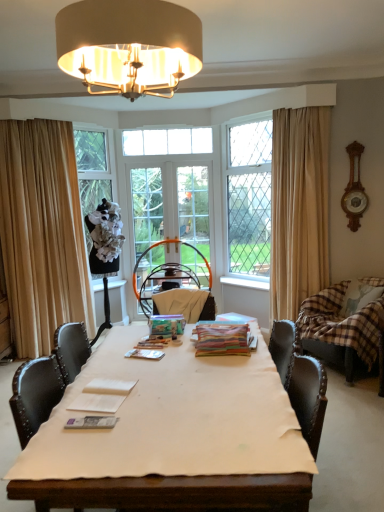
Question: Is clear glass door at center, placed as the first screen door when sorted from left to right, at the left side of multicolored paper stack at center, acting as the third magazine starting from the front?

Choices:
 (A) no
 (B) yes

Answer: (B)

Question: Is clear glass door at center, marked as the 2th screen door in a right-to-left arrangement, taller than multicolored paper stack at center, acting as the third magazine starting from the front?

Choices:
 (A) yes
 (B) no

Answer: (A)

Question: Is clear glass door at center, placed as the first screen door when sorted from left to right, further to camera compared to multicolored paper stack at center, the 1th magazine when ordered from top to bottom?

Choices:
 (A) no
 (B) yes

Answer: (B)

Question: From the image's perspective, is clear glass door at center, placed as the first screen door when sorted from left to right, located above multicolored paper stack at center, marked as the first magazine in a back-to-front arrangement?

Choices:
 (A) yes
 (B) no

Answer: (A)

Question: From the image's perspective, is clear glass door at center, placed as the first screen door when sorted from left to right, below multicolored paper stack at center, marked as the 3th magazine in a bottom-to-top arrangement?

Choices:
 (A) no
 (B) yes

Answer: (A)

Question: Can you confirm if clear glass door at center, placed as the first screen door when sorted from left to right, is wider than multicolored paper stack at center, marked as the first magazine in a back-to-front arrangement?

Choices:
 (A) no
 (B) yes

Answer: (A)

Question: Can you confirm if beige fabric curtain at right, acting as the 2th curtain starting from the left, is shorter than clear glass window at center, the first window viewed from the right?

Choices:
 (A) yes
 (B) no

Answer: (B)

Question: Is beige fabric curtain at right, acting as the 2th curtain starting from the left, wider than clear glass window at center, acting as the 2th window starting from the left?

Choices:
 (A) no
 (B) yes

Answer: (B)

Question: Are beige fabric curtain at right, acting as the 2th curtain starting from the left, and clear glass window at center, the first window viewed from the right, far apart?

Choices:
 (A) yes
 (B) no

Answer: (B)

Question: Is beige fabric curtain at right, placed as the first curtain when sorted from right to left, positioned in front of clear glass window at center, the 2th window positioned from the back?

Choices:
 (A) no
 (B) yes

Answer: (B)

Question: Would you say beige fabric curtain at right, acting as the 2th curtain starting from the left, is outside clear glass window at center, acting as the 2th window starting from the left?

Choices:
 (A) yes
 (B) no

Answer: (A)

Question: Is beige fabric curtain at right, acting as the 2th curtain starting from the left, oriented towards clear glass window at center, the first window viewed from the right?

Choices:
 (A) yes
 (B) no

Answer: (B)

Question: Is metallic silver magazine at center, the second magazine when ordered from right to left, oriented away from clear glass window at center, acting as the 2th window starting from the left?

Choices:
 (A) no
 (B) yes

Answer: (A)